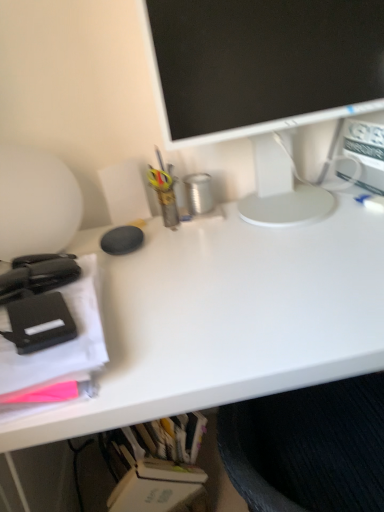
In order to face black matte stapler at left, which appears as the second office supplies when viewed from the front, should I rotate leftwards or rightwards?

Rotate left and turn 20.861 degrees.

This screenshot has height=512, width=384. What are the coordinates of `white glossy monitor at upper center` in the screenshot? It's located at (265, 81).

Can you confirm if matte black stapler at left, which appears as the 2th office supplies when viewed from the back, is positioned to the left of white matte desk at center?

Indeed, matte black stapler at left, which appears as the 2th office supplies when viewed from the back, is positioned on the left side of white matte desk at center.

Considering the positions of objects matte black stapler at left, arranged as the first office supplies when viewed from the front, and white matte desk at center in the image provided, who is behind, matte black stapler at left, arranged as the first office supplies when viewed from the front, or white matte desk at center?

white matte desk at center is behind.

Is matte black stapler at left, which appears as the 2th office supplies when viewed from the back, not inside white matte desk at center?

matte black stapler at left, which appears as the 2th office supplies when viewed from the back, lies outside white matte desk at center's area.

How different are the orientations of matte black stapler at left, arranged as the first office supplies when viewed from the front, and white matte desk at center in degrees?

There is a 1.75-degree angle between the facing directions of matte black stapler at left, arranged as the first office supplies when viewed from the front, and white matte desk at center.

Considering the points (184, 58) and (94, 274), which point is in front, point (184, 58) or point (94, 274)?

The point (94, 274) is closer to the camera.

In the image, is white glossy monitor at upper center on the left side or the right side of matte black stapler at left, arranged as the first office supplies when viewed from the front?

white glossy monitor at upper center is positioned on matte black stapler at left, arranged as the first office supplies when viewed from the front,'s right side.

Is the depth of white glossy monitor at upper center less than that of matte black stapler at left, which appears as the 2th office supplies when viewed from the back?

No, the depth of white glossy monitor at upper center is greater than that of matte black stapler at left, which appears as the 2th office supplies when viewed from the back.

Is matte black stapler at left, arranged as the first office supplies when viewed from the front, at the back of white glossy monitor at upper center?

white glossy monitor at upper center does not have its back to matte black stapler at left, arranged as the first office supplies when viewed from the front.

Measure the distance between white glossy monitor at upper center and black matte stapler at left, which ranks as the first office supplies in back-to-front order.

white glossy monitor at upper center is 19.54 inches away from black matte stapler at left, which ranks as the first office supplies in back-to-front order.

Considering their positions, is white glossy monitor at upper center located in front of or behind black matte stapler at left, which ranks as the first office supplies in back-to-front order?

Clearly, white glossy monitor at upper center is behind black matte stapler at left, which ranks as the first office supplies in back-to-front order.

From a real-world perspective, who is located lower, white glossy monitor at upper center or black matte stapler at left, which appears as the second office supplies when viewed from the front?

black matte stapler at left, which appears as the second office supplies when viewed from the front, from a real-world perspective.

Who is taller, white glossy monitor at upper center or black matte stapler at left, which ranks as the first office supplies in back-to-front order?

With more height is white glossy monitor at upper center.

Consider the image. From a real-world perspective, which object stands above the other?

In real-world perspective, white glossy monitor at upper center is above.

Which of these two, matte black stapler at left, arranged as the first office supplies when viewed from the front, or white glossy monitor at upper center, is bigger?

white glossy monitor at upper center.

Considering the sizes of objects matte black stapler at left, arranged as the first office supplies when viewed from the front, and white glossy monitor at upper center in the image provided, who is shorter, matte black stapler at left, arranged as the first office supplies when viewed from the front, or white glossy monitor at upper center?

matte black stapler at left, arranged as the first office supplies when viewed from the front, is shorter.

Looking at this image, how many degrees apart are the facing directions of matte black stapler at left, which appears as the 2th office supplies when viewed from the back, and white glossy monitor at upper center?

The angle between the facing direction of matte black stapler at left, which appears as the 2th office supplies when viewed from the back, and the facing direction of white glossy monitor at upper center is 4.12 degrees.

From the image's perspective, is black matte stapler at left, which appears as the second office supplies when viewed from the front, located beneath white matte desk at center?

No.

Locate an element on the screen. This screenshot has width=384, height=512. office supplies that is behind the white matte desk at center is located at coordinates (38, 276).

Are black matte stapler at left, which appears as the second office supplies when viewed from the front, and white matte desk at center far apart?

No, black matte stapler at left, which appears as the second office supplies when viewed from the front, is not far from white matte desk at center.

Is black matte stapler at left, which appears as the second office supplies when viewed from the front, thinner than white matte desk at center?

Indeed, black matte stapler at left, which appears as the second office supplies when viewed from the front, has a lesser width compared to white matte desk at center.

Considering the sizes of objects white matte desk at center and white glossy monitor at upper center in the image provided, who is taller, white matte desk at center or white glossy monitor at upper center?

With more height is white matte desk at center.

Is white matte desk at center positioned with its back to white glossy monitor at upper center?

white matte desk at center does not have its back to white glossy monitor at upper center.

Which is closer, (293,294) or (156,71)?

Point (293,294).

What's the angular difference between white matte desk at center and white glossy monitor at upper center's facing directions?

The angle between the facing direction of white matte desk at center and the facing direction of white glossy monitor at upper center is 2.37 degrees.

Is black matte stapler at left, which appears as the second office supplies when viewed from the front, in front of or behind white glossy monitor at upper center in the image?

Clearly, black matte stapler at left, which appears as the second office supplies when viewed from the front, is in front of white glossy monitor at upper center.

Is black matte stapler at left, which appears as the second office supplies when viewed from the front, inside the boundaries of white glossy monitor at upper center, or outside?

The correct answer is: outside.

Based on the photo, is black matte stapler at left, which appears as the second office supplies when viewed from the front, oriented towards white glossy monitor at upper center?

No.

From the picture: In terms of size, does black matte stapler at left, which ranks as the first office supplies in back-to-front order, appear bigger or smaller than white glossy monitor at upper center?

Clearly, black matte stapler at left, which ranks as the first office supplies in back-to-front order, is smaller in size than white glossy monitor at upper center.

Image resolution: width=384 pixels, height=512 pixels. In order to click on desk on the right of matte black stapler at left, arranged as the first office supplies when viewed from the front in this screenshot , I will do `click(225, 318)`.

Locate an element on the screen. Image resolution: width=384 pixels, height=512 pixels. television above the matte black stapler at left, arranged as the first office supplies when viewed from the front (from the image's perspective) is located at coordinates (265, 81).

Estimate the real-world distances between objects in this image. Which object is further from white glossy monitor at upper center, white matte desk at center or black matte stapler at left, which ranks as the first office supplies in back-to-front order?

Based on the image, black matte stapler at left, which ranks as the first office supplies in back-to-front order, appears to be further to white glossy monitor at upper center.

Which object lies further to the anchor point matte black stapler at left, which appears as the 2th office supplies when viewed from the back, black matte stapler at left, which appears as the second office supplies when viewed from the front, or white glossy monitor at upper center?

white glossy monitor at upper center lies further to matte black stapler at left, which appears as the 2th office supplies when viewed from the back, than the other object.

Looking at this image, when comparing their distances from matte black stapler at left, which appears as the 2th office supplies when viewed from the back, does white matte desk at center or white glossy monitor at upper center seem closer?

white matte desk at center lies closer to matte black stapler at left, which appears as the 2th office supplies when viewed from the back, than the other object.

Considering their positions, is white matte desk at center positioned closer to matte black stapler at left, arranged as the first office supplies when viewed from the front, than black matte stapler at left, which appears as the second office supplies when viewed from the front?

black matte stapler at left, which appears as the second office supplies when viewed from the front, is closer to matte black stapler at left, arranged as the first office supplies when viewed from the front.

From the image, which object appears to be farther from white matte desk at center, white glossy monitor at upper center or black matte stapler at left, which ranks as the first office supplies in back-to-front order?

Based on the image, black matte stapler at left, which ranks as the first office supplies in back-to-front order, appears to be further to white matte desk at center.

Which object lies further to the anchor point matte black stapler at left, arranged as the first office supplies when viewed from the front, white glossy monitor at upper center or white matte desk at center?

Among the two, white glossy monitor at upper center is located further to matte black stapler at left, arranged as the first office supplies when viewed from the front.

From the image, which object appears to be farther from white glossy monitor at upper center, black matte stapler at left, which appears as the second office supplies when viewed from the front, or matte black stapler at left, which appears as the 2th office supplies when viewed from the back?

black matte stapler at left, which appears as the second office supplies when viewed from the front.

In the scene shown: Looking at the image, which one is located further to black matte stapler at left, which ranks as the first office supplies in back-to-front order, white matte desk at center or matte black stapler at left, which appears as the 2th office supplies when viewed from the back?

The object further to black matte stapler at left, which ranks as the first office supplies in back-to-front order, is white matte desk at center.

Where is `office supplies located between black matte stapler at left, which appears as the second office supplies when viewed from the front, and white matte desk at center in the left-right direction`? The width and height of the screenshot is (384, 512). office supplies located between black matte stapler at left, which appears as the second office supplies when viewed from the front, and white matte desk at center in the left-right direction is located at coordinates [x=64, y=343].

You are a GUI agent. You are given a task and a screenshot of the screen. Output one action in this format:
    pyautogui.click(x=<x>, y=<y>)
    Task: Click on the office supplies between black matte stapler at left, which ranks as the first office supplies in back-to-front order, and white glossy monitor at upper center from left to right
    
    Given the screenshot: What is the action you would take?
    pyautogui.click(x=64, y=343)